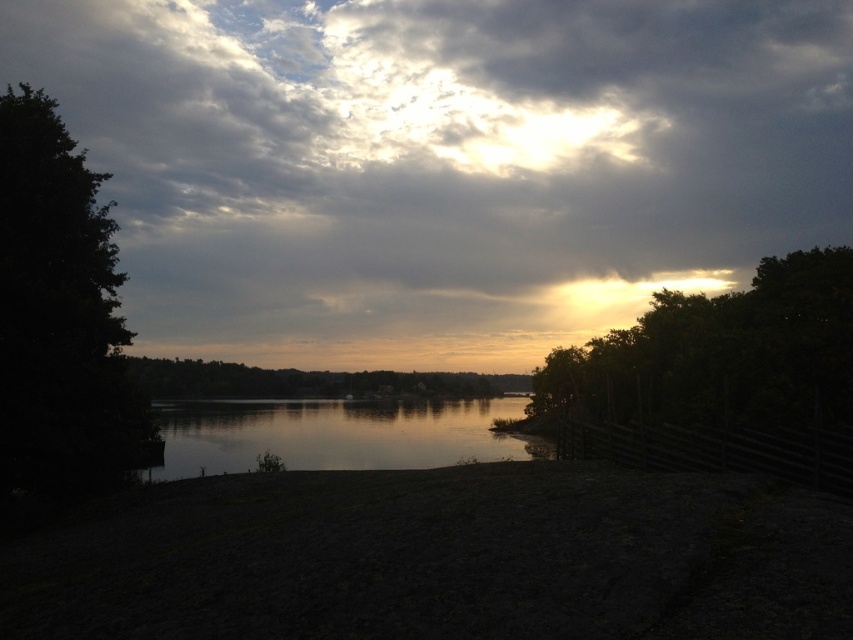
You are standing at the lakeside and want to determine which of the two points, point (218, 442) or point (131, 356), is closer to you. Based on the scene, which point is nearer?

Point (218, 442) is closer to the camera than point (131, 356), so it is the nearer one.

You are a drone operator who needs to capture a photo of the cloudy sky at upper center and the silvery reflective water at center. Given that your drone can only fly up to 60 meters high, will it be able to reach the required altitude to capture both objects in one shot?

The distance between the cloudy sky at upper center and the silvery reflective water at center is 61.24 meters. Since the drone can only fly up to 60 meters, it will not be able to reach the required altitude to capture both objects in one shot.

You are standing at the point marked as point (59, 314) in the image. Based on the scene description, what type of object are you currently standing on?

You are standing on a dark green leafy tree at left.